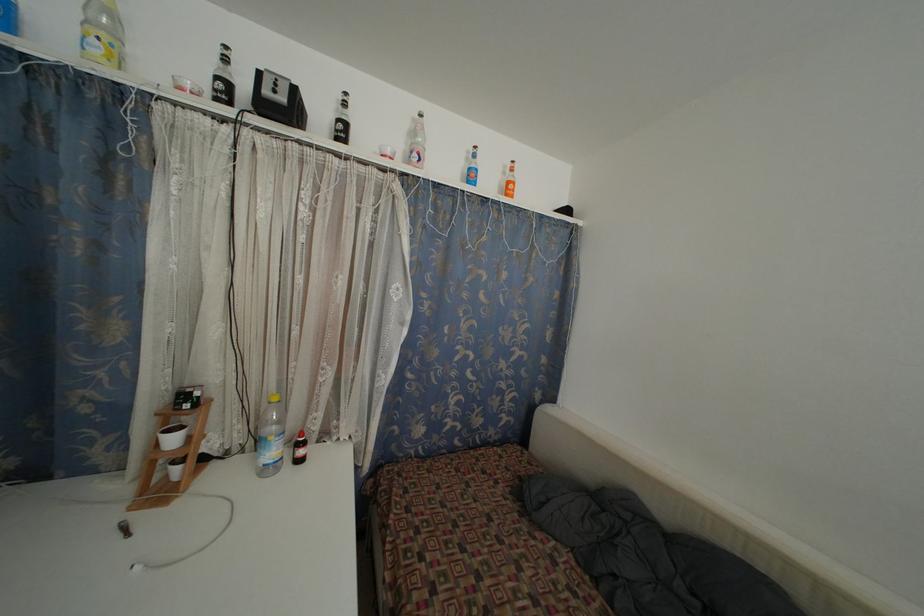
The image size is (924, 616). What do you see at coordinates (509, 180) in the screenshot? I see `the orange glass bottle` at bounding box center [509, 180].